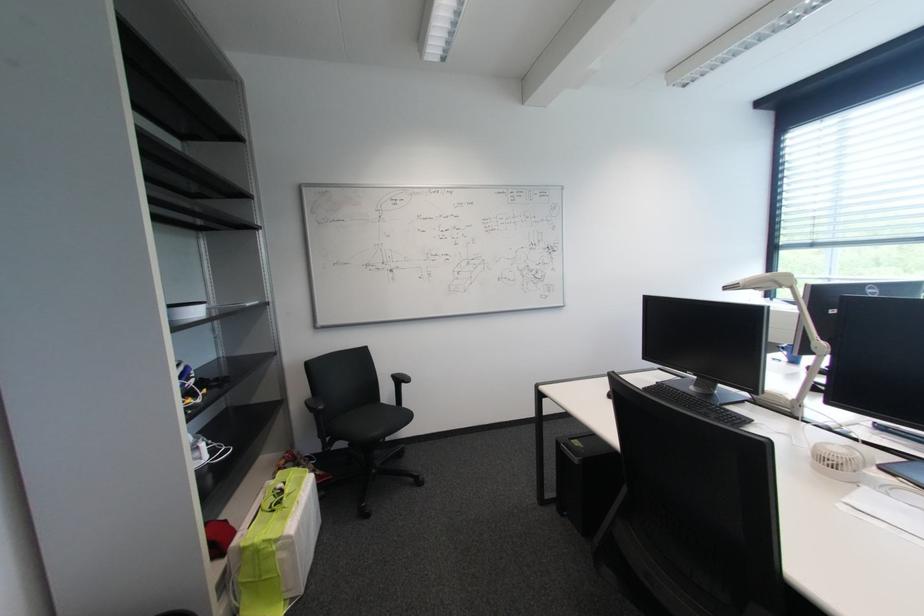
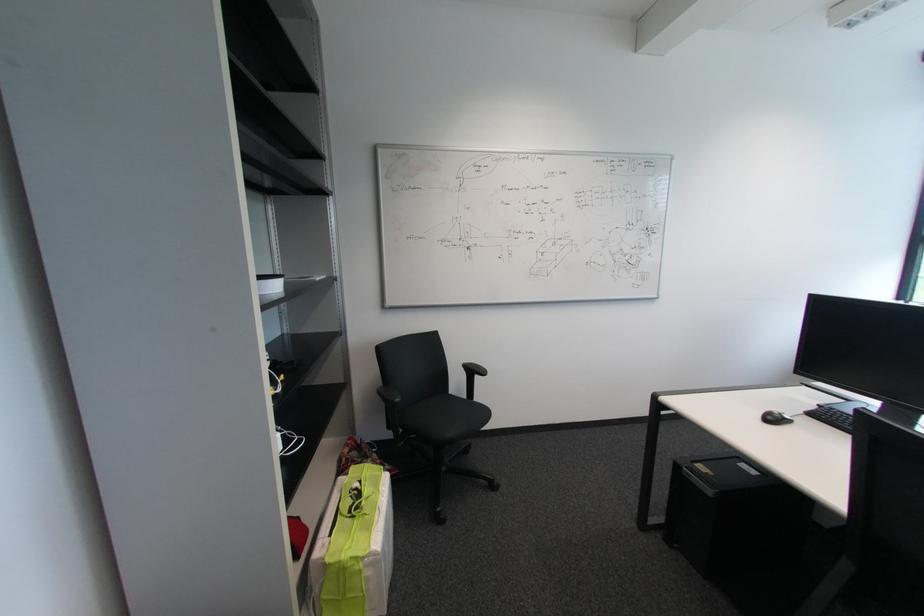
Find the pixel in the second image that matches the point at 334,439 in the first image.

(407, 432)